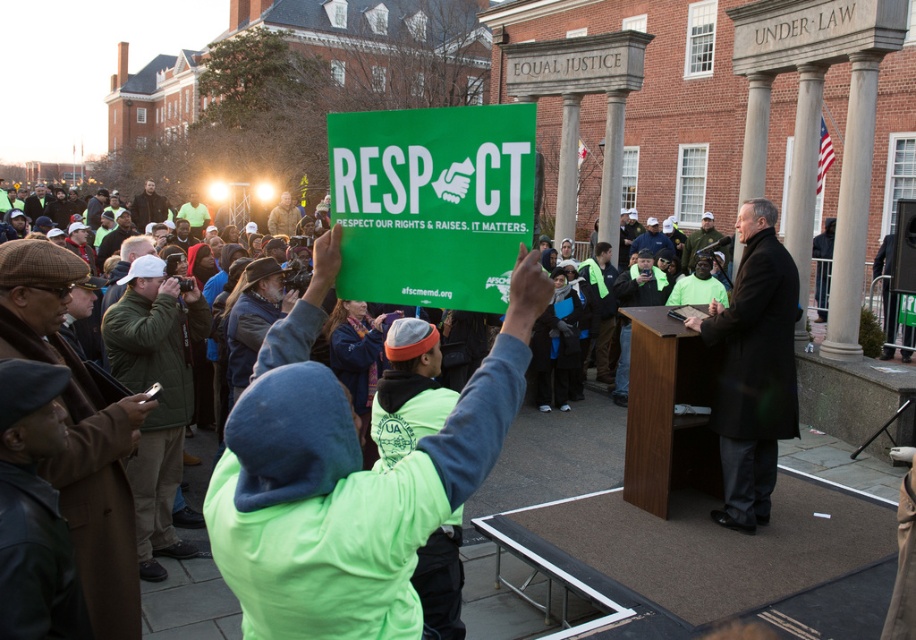
Who is positioned more to the right, neon green jacket at center or black coat at center?

black coat at center is more to the right.

Does neon green jacket at center appear under black coat at center?

Incorrect, neon green jacket at center is not positioned below black coat at center.

At what (x,y) coordinates should I click in order to perform the action: click on neon green jacket at center. Please return your answer as a coordinate pair (x, y). Looking at the image, I should click on (347, 484).

Find the location of a particular element. Image resolution: width=916 pixels, height=640 pixels. neon green jacket at center is located at coordinates (347, 484).